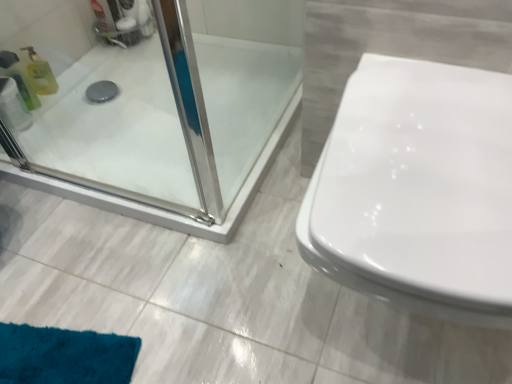
You are a GUI agent. You are given a task and a screenshot of the screen. Output one action in this format:
    pyautogui.click(x=<x>, y=<y>)
    Task: Click on the free location to the right of translucent yellow bottle at left, the second cleaning product positioned from the back
    This screenshot has width=512, height=384.
    Given the screenshot: What is the action you would take?
    pyautogui.click(x=77, y=113)